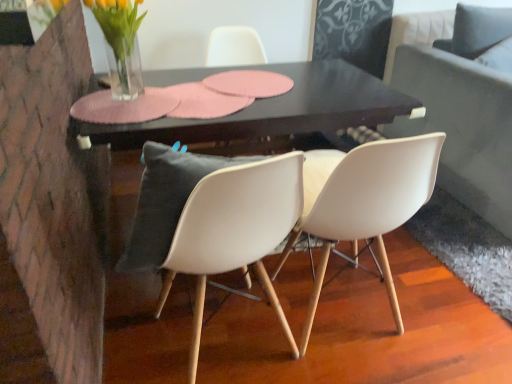
Where is `vacant area located to the right-hand side of white matte chair at center, the 2th chair when ordered from back to front`? vacant area located to the right-hand side of white matte chair at center, the 2th chair when ordered from back to front is located at coordinates (444, 308).